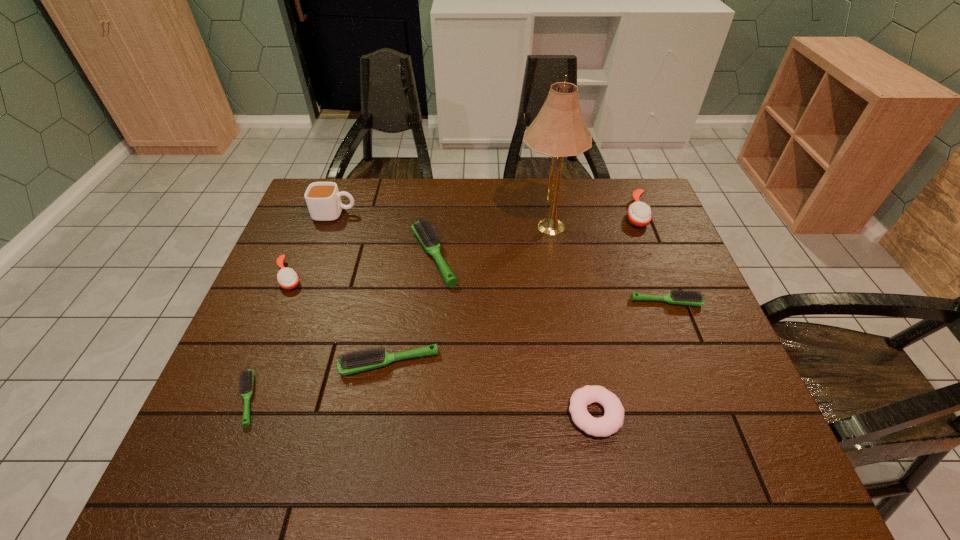
This screenshot has height=540, width=960. What are the coordinates of `blank space located 0.050m on the back of the nearer orange hairbrush` in the screenshot? It's located at (301, 248).

Identify the location of vacant area located on the front of the third nearest hairbrush. (695, 377).

Where is `vacant space situated on the right of the doughnut`? vacant space situated on the right of the doughnut is located at coordinates coord(646,414).

This screenshot has height=540, width=960. What are the coordinates of `vacant region located 0.050m on the right of the smallest light hairbrush` in the screenshot? It's located at (285, 399).

At what (x,y) coordinates should I click in order to perform the action: click on lampshade located at the far edge. Please return your answer as a coordinate pair (x, y). The width and height of the screenshot is (960, 540). Looking at the image, I should click on (559, 130).

Image resolution: width=960 pixels, height=540 pixels. I want to click on cup located at the far edge, so click(x=323, y=199).

Where is `hairbrush positioned at the far edge`? The image size is (960, 540). hairbrush positioned at the far edge is located at coordinates (639, 214).

Image resolution: width=960 pixels, height=540 pixels. Find the location of `object located at the near edge`. object located at the near edge is located at coordinates (612, 421).

You are a GUI agent. You are given a task and a screenshot of the screen. Output one action in this format:
    pyautogui.click(x=<x>, y=<y>)
    Task: Click on the cup located at the left edge
    
    Given the screenshot: What is the action you would take?
    pyautogui.click(x=323, y=199)

Locate an element on the screen. This screenshot has height=540, width=960. object at the far left corner is located at coordinates (323, 199).